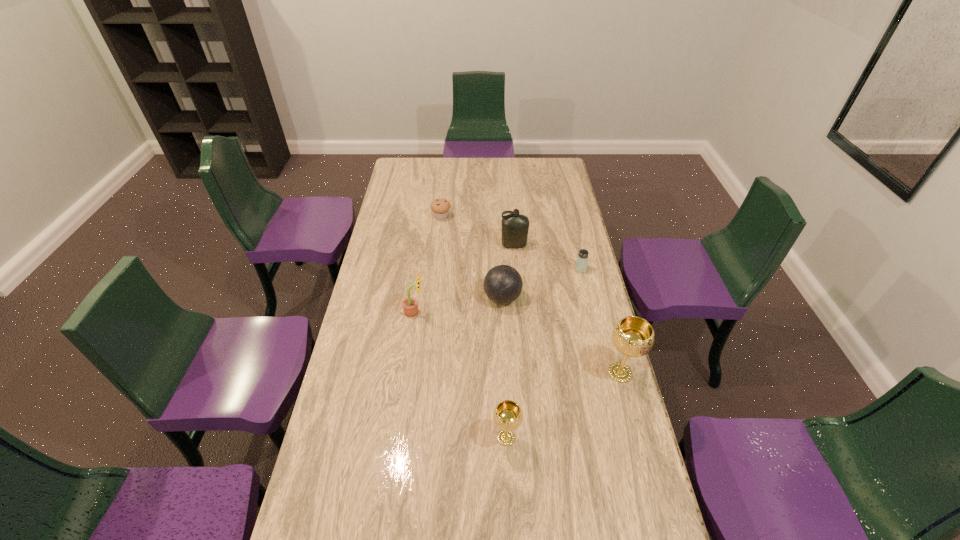
The image size is (960, 540). I want to click on vacant point located on the front of the sixth farthest object, so click(x=632, y=418).

Where is `free space located on the front of the saltshaker`? This screenshot has width=960, height=540. free space located on the front of the saltshaker is located at coordinates (592, 317).

Where is `free location located 0.150m on the back of the muffin`? free location located 0.150m on the back of the muffin is located at coordinates (444, 193).

The width and height of the screenshot is (960, 540). In order to click on vacant space located 0.200m on the grip area of the bowling ball in this screenshot , I will do `click(430, 298)`.

Where is `free space located 0.050m on the grip area of the bowling ball`? The height and width of the screenshot is (540, 960). free space located 0.050m on the grip area of the bowling ball is located at coordinates (469, 298).

Where is `vacant space located 0.080m on the grip area of the bowling ball`? vacant space located 0.080m on the grip area of the bowling ball is located at coordinates (462, 298).

Where is `vacant space located 0.320m on the face of the sunflower`? This screenshot has width=960, height=540. vacant space located 0.320m on the face of the sunflower is located at coordinates (513, 312).

Find the location of a particular element. This screenshot has width=960, height=540. free space located on the back of the sixth nearest object is located at coordinates (510, 198).

This screenshot has height=540, width=960. I want to click on chalice that is at the right edge, so click(x=633, y=336).

The height and width of the screenshot is (540, 960). What are the coordinates of `saltshaker that is at the right edge` in the screenshot? It's located at (582, 258).